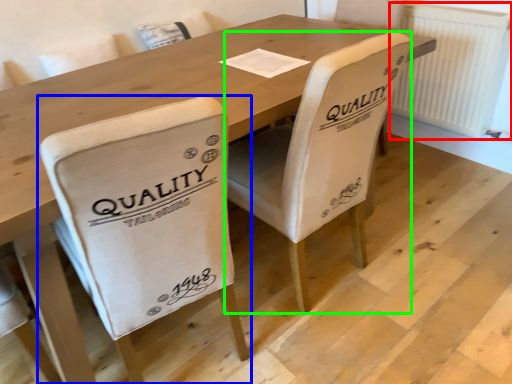
Question: Which object is the closest to the radiator (highlighted by a red box)? Choose among these: chair (highlighted by a blue box) or chair (highlighted by a green box).

Choices:
 (A) chair
 (B) chair

Answer: (B)